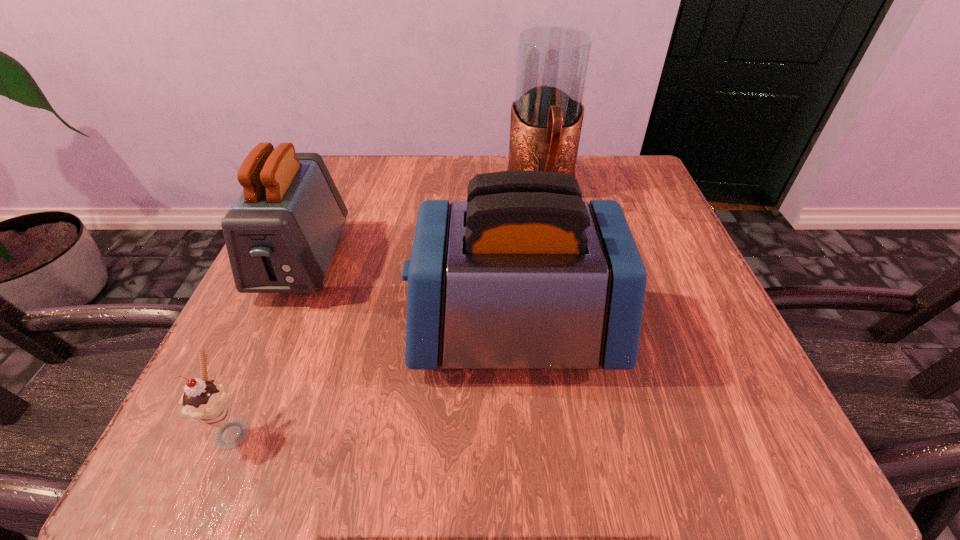
In order to click on pitcher in this screenshot , I will do `click(546, 120)`.

Find the location of a particular element. the right toaster is located at coordinates (524, 274).

Identify the location of the taller toaster. (524, 274).

The height and width of the screenshot is (540, 960). What are the coordinates of `the second shortest object` in the screenshot? It's located at (281, 232).

The width and height of the screenshot is (960, 540). What are the coordinates of `the shorter toaster` in the screenshot? It's located at (281, 232).

Where is `the shortest object`? the shortest object is located at coordinates click(x=205, y=401).

Image resolution: width=960 pixels, height=540 pixels. In order to click on the nearest object in this screenshot , I will do `click(205, 401)`.

The image size is (960, 540). Find the location of `free location located with the handle on the side of the pitcher`. free location located with the handle on the side of the pitcher is located at coordinates (553, 259).

This screenshot has width=960, height=540. What are the coordinates of `free space located 0.240m on the front-facing side of the right toaster` in the screenshot? It's located at (259, 332).

This screenshot has height=540, width=960. In order to click on blank space located on the front-facing side of the right toaster in this screenshot , I will do `click(240, 332)`.